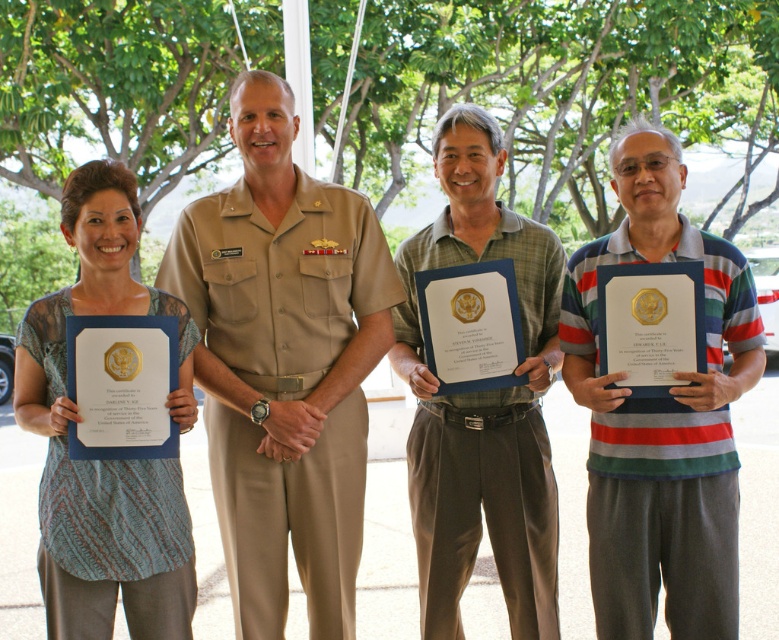
You are standing at the origin point in the image. Which direction should you move to reach the tan uniform at center?

The tan uniform at center is located at point (x=284, y=364), so you should move towards the center of the image to reach it.

You are a photographer at the event and need to ensure all attendees are visible in the group photo. Given the tan uniform at center and the printed fabric shirt at center, which one might block the view of the other? Please explain based on their heights.

The tan uniform at center is much taller than the printed fabric shirt at center, so the tan uniform at center might block the view of the printed fabric shirt at center in the group photo.